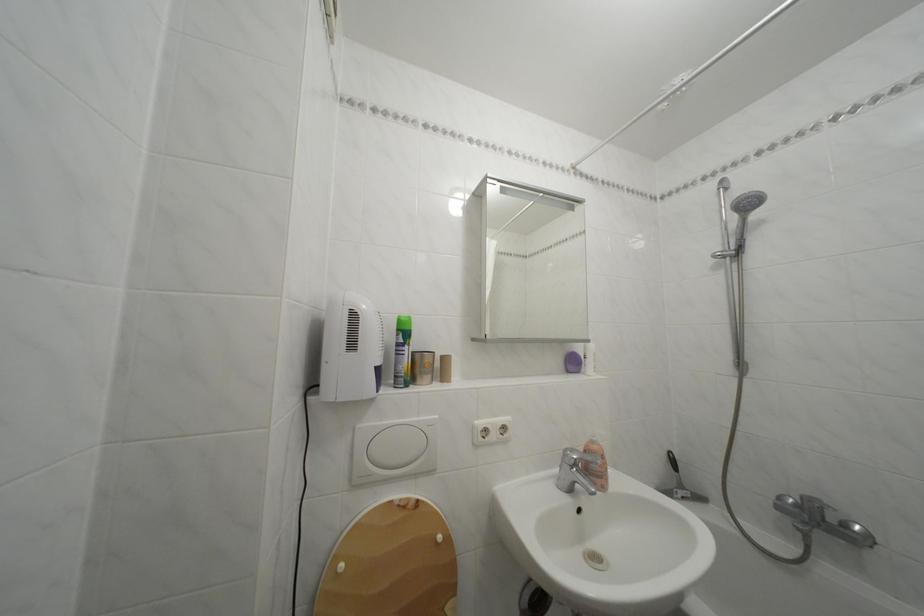
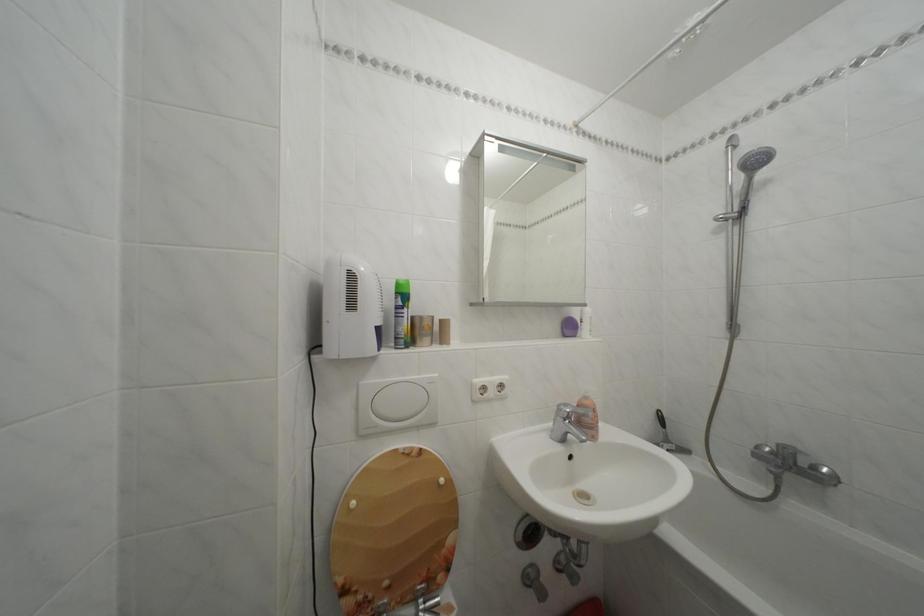
In a continuous first-person perspective shot, in which direction is the camera moving?

The cameraman walked toward right, backward.